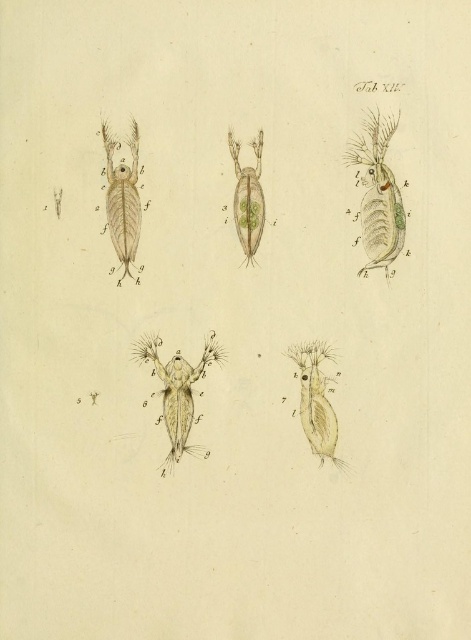
Based on the photo, between translucent greenish-yellow at upper left and translucent beige crustacean at lower right, which one has more height?

Standing taller between the two is translucent greenish-yellow at upper left.

Can you confirm if translucent greenish-yellow at upper left is positioned below translucent beige crustacean at lower right?

No.

Identify the location of translucent greenish-yellow at upper left. (122, 198).

Between translucent beige crustacean at center and translucent beige crustacean at lower right, which one appears on the left side from the viewer's perspective?

translucent beige crustacean at center

Between translucent beige crustacean at center and translucent beige crustacean at lower right, which one has more height?

With more height is translucent beige crustacean at center.

Is point (157, 422) behind point (303, 360)?

That is False.

The height and width of the screenshot is (640, 471). I want to click on translucent beige crustacean at center, so click(x=178, y=392).

Which is more to the right, translucent beige crustacean at lower right or translucent greenish-yellow at center?

From the viewer's perspective, translucent beige crustacean at lower right appears more on the right side.

Can you confirm if translucent beige crustacean at lower right is taller than translucent greenish-yellow at center?

No, translucent beige crustacean at lower right is not taller than translucent greenish-yellow at center.

Where is `translucent beige crustacean at lower right`? This screenshot has height=640, width=471. translucent beige crustacean at lower right is located at coordinates (316, 401).

This screenshot has width=471, height=640. I want to click on translucent beige crustacean at lower right, so point(316,401).